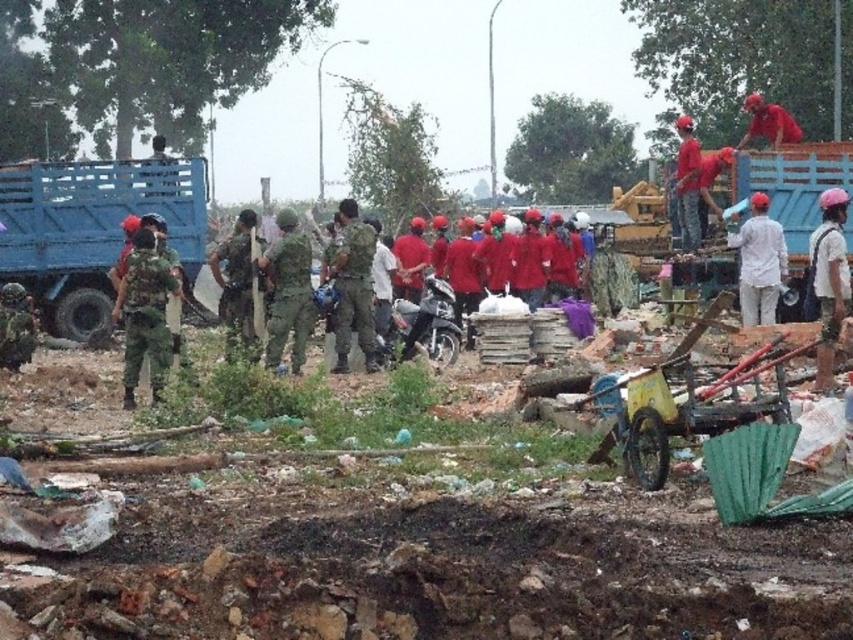
You are a delivery person who needs to reach the camouflage fabric uniform at center to drop off a package. There is a blue matte truck at left blocking the path. Can you go around the truck to reach the uniform?

The camouflage fabric uniform at center is behind the blue matte truck at left, so you can go around the truck to reach the uniform.

You are standing at the center of the construction site and want to move towards the blue matte truck at left. Which direction should you move in?

Since the blue matte truck at left is located at point (91, 228), you should move towards the left side of the site to reach it.

In the scene shown: You are standing at the center of the construction site and see the point marked at coordinates (358, 250). What object or feature is located at that point?

The point at coordinates (358, 250) marks the location of the red matte uniform at center.